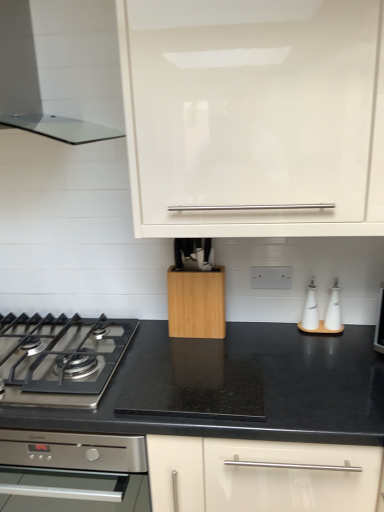
Identify the location of stainless steel gas stove at lower left. (61, 359).

You are a GUI agent. You are given a task and a screenshot of the screen. Output one action in this format:
    pyautogui.click(x=<x>, y=<y>)
    Task: Click on the beech wood knife block at center
    This screenshot has height=512, width=384.
    Given the screenshot: What is the action you would take?
    pyautogui.click(x=196, y=303)

The image size is (384, 512). Identify the location of transparent glass range hood at upper left. (62, 63).

This screenshot has height=512, width=384. In order to click on white glossy oil bottles at right in this screenshot , I will do `click(310, 309)`.

The height and width of the screenshot is (512, 384). I want to click on stainless steel gas stove at lower left, so click(61, 359).

At what (x,y) coordinates should I click in order to perform the action: click on kitchen appliance that appears on the right of stainless steel gas stove at lower left. Please return your answer as a coordinate pair (x, y). Image resolution: width=384 pixels, height=512 pixels. Looking at the image, I should click on (196, 303).

Between stainless steel gas stove at lower left and beech wood knife block at center, which one is positioned in front?

Answer: Positioned in front is stainless steel gas stove at lower left.

Is stainless steel gas stove at lower left wider or thinner than beech wood knife block at center?

In the image, stainless steel gas stove at lower left appears to be wider than beech wood knife block at center.

From a real-world perspective, is stainless steel gas stove at lower left physically located above or below beech wood knife block at center?

Clearly, from a real-world perspective, stainless steel gas stove at lower left is below beech wood knife block at center.

Between white glossy cabinet at upper center and beech wood knife block at center, which one has less height?

With less height is beech wood knife block at center.

From a real-world perspective, which object rests below the other?

From a 3D spatial view, beech wood knife block at center is below.

From the image's perspective, is white glossy cabinet at upper center on beech wood knife block at center?

Indeed, from the image's perspective, white glossy cabinet at upper center is shown above beech wood knife block at center.

Is point (229, 45) closer to viewer compared to point (224, 295)?

Yes.

From the image's perspective, does beech wood knife block at center appear lower than white glossy oil bottles at right?

No, from the image's perspective, beech wood knife block at center is not below white glossy oil bottles at right.

From a real-world perspective, between beech wood knife block at center and white glossy oil bottles at right, who is vertically higher?

beech wood knife block at center.

From the picture: How far apart are beech wood knife block at center and white glossy oil bottles at right?

beech wood knife block at center and white glossy oil bottles at right are 15.64 inches apart from each other.

Is beech wood knife block at center taller or shorter than white glossy oil bottles at right?

Clearly, beech wood knife block at center is taller compared to white glossy oil bottles at right.

Locate an element on the screen. The image size is (384, 512). kitchen appliance below the transparent glass range hood at upper left (from the image's perspective) is located at coordinates (196, 303).

Who is smaller, transparent glass range hood at upper left or beech wood knife block at center?

beech wood knife block at center is smaller.

Can you confirm if transparent glass range hood at upper left is thinner than beech wood knife block at center?

No, transparent glass range hood at upper left is not thinner than beech wood knife block at center.

What's the angular difference between transparent glass range hood at upper left and beech wood knife block at center's facing directions?

0.225 degrees separate the facing orientations of transparent glass range hood at upper left and beech wood knife block at center.

The image size is (384, 512). Find the location of `home appliance positioned vertically above the beech wood knife block at center (from a real-world perspective)`. home appliance positioned vertically above the beech wood knife block at center (from a real-world perspective) is located at coordinates (62, 63).

Would you say beech wood knife block at center is inside or outside transparent glass range hood at upper left?

beech wood knife block at center is not inside transparent glass range hood at upper left, it's outside.

How distant is beech wood knife block at center from transparent glass range hood at upper left?

A: beech wood knife block at center is 29.34 inches away from transparent glass range hood at upper left.

Which point is more distant from viewer, (180, 298) or (74, 320)?

Positioned behind is point (74, 320).

Based on the photo, is beech wood knife block at center bigger than stainless steel gas stove at lower left?

No.

Is beech wood knife block at center far from stainless steel gas stove at lower left?

No, there isn't a large distance between beech wood knife block at center and stainless steel gas stove at lower left.

Find the location of a particular element. kitchen appliance above the stainless steel gas stove at lower left (from the image's perspective) is located at coordinates (196, 303).

Consider the image. Between transparent glass range hood at upper left and stainless steel gas stove at lower left, which one has smaller size?

With smaller size is stainless steel gas stove at lower left.

From a real-world perspective, which is physically above, transparent glass range hood at upper left or stainless steel gas stove at lower left?

transparent glass range hood at upper left, from a real-world perspective.

Who is taller, transparent glass range hood at upper left or stainless steel gas stove at lower left?

With more height is transparent glass range hood at upper left.

Consider the image. Does transparent glass range hood at upper left turn towards stainless steel gas stove at lower left?

No.

I want to click on kitchen appliance located on the right of stainless steel gas stove at lower left, so click(x=196, y=303).

Where is `kitchen appliance behind the white glossy cabinet at upper center`? kitchen appliance behind the white glossy cabinet at upper center is located at coordinates (196, 303).

From the image, which object appears to be farther from white glossy cabinet at upper center, stainless steel gas stove at lower left or beech wood knife block at center?

stainless steel gas stove at lower left.

From the image, which object appears to be nearer to transparent glass range hood at upper left, beech wood knife block at center or stainless steel gas stove at lower left?

Among the two, beech wood knife block at center is located nearer to transparent glass range hood at upper left.

Considering their positions, is white glossy oil bottles at right positioned closer to beech wood knife block at center than transparent glass range hood at upper left?

white glossy oil bottles at right is positioned closer to the anchor beech wood knife block at center.

Which object lies nearer to the anchor point white glossy cabinet at upper center, beech wood knife block at center or stainless steel gas stove at lower left?

The object closer to white glossy cabinet at upper center is beech wood knife block at center.

Estimate the real-world distances between objects in this image. Which object is further from white glossy oil bottles at right, beech wood knife block at center or stainless steel gas stove at lower left?

stainless steel gas stove at lower left is positioned further to the anchor white glossy oil bottles at right.

Looking at the image, which one is located further to white glossy oil bottles at right, transparent glass range hood at upper left or stainless steel gas stove at lower left?

transparent glass range hood at upper left is further to white glossy oil bottles at right.

When comparing their distances from white glossy cabinet at upper center, does stainless steel gas stove at lower left or white glossy oil bottles at right seem further?

stainless steel gas stove at lower left is positioned further to the anchor white glossy cabinet at upper center.

Based on their spatial positions, is white glossy cabinet at upper center or transparent glass range hood at upper left closer to stainless steel gas stove at lower left?

white glossy cabinet at upper center.

Find the location of a particular element. kitchen appliance between transparent glass range hood at upper left and white glossy oil bottles at right from left to right is located at coordinates (196, 303).

This screenshot has height=512, width=384. Find the location of `kitchen appliance situated between stainless steel gas stove at lower left and white glossy oil bottles at right from left to right`. kitchen appliance situated between stainless steel gas stove at lower left and white glossy oil bottles at right from left to right is located at coordinates (196, 303).

This screenshot has width=384, height=512. What are the coordinates of `cabinetry between transparent glass range hood at upper left and white glossy oil bottles at right from left to right` in the screenshot? It's located at (254, 116).

Find the location of a particular element. Image resolution: width=384 pixels, height=512 pixels. cabinetry between transparent glass range hood at upper left and stainless steel gas stove at lower left in the up-down direction is located at coordinates (254, 116).